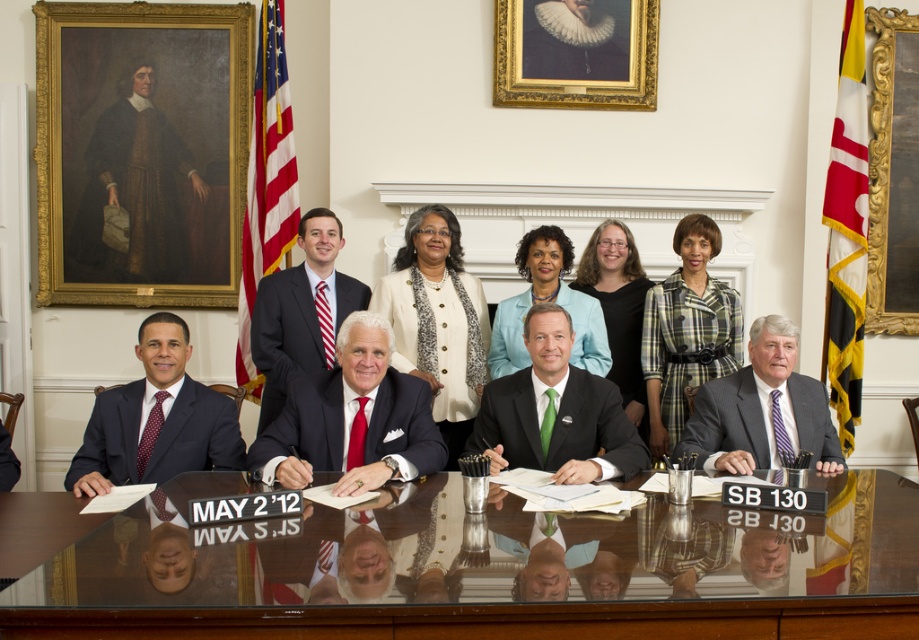
Question: Which object is the closest to the shiny dark suit at center?

Choices:
 (A) transparent glass table at center
 (B) matte black suit at center

Answer: (B)

Question: Is matte black suit at center wider than shiny dark suit at center?

Choices:
 (A) no
 (B) yes

Answer: (B)

Question: Is matte black suit at center below green silk tie at center?

Choices:
 (A) no
 (B) yes

Answer: (B)

Question: Does green silk tie at center appear under striped tie at center?

Choices:
 (A) yes
 (B) no

Answer: (B)

Question: Which point is closer to the camera?

Choices:
 (A) matte black suit at left
 (B) transparent glass table at center

Answer: (B)

Question: Which point is closer to the camera?

Choices:
 (A) striped tie at center
 (B) matte black suit at center
 (C) transparent glass table at center

Answer: (C)